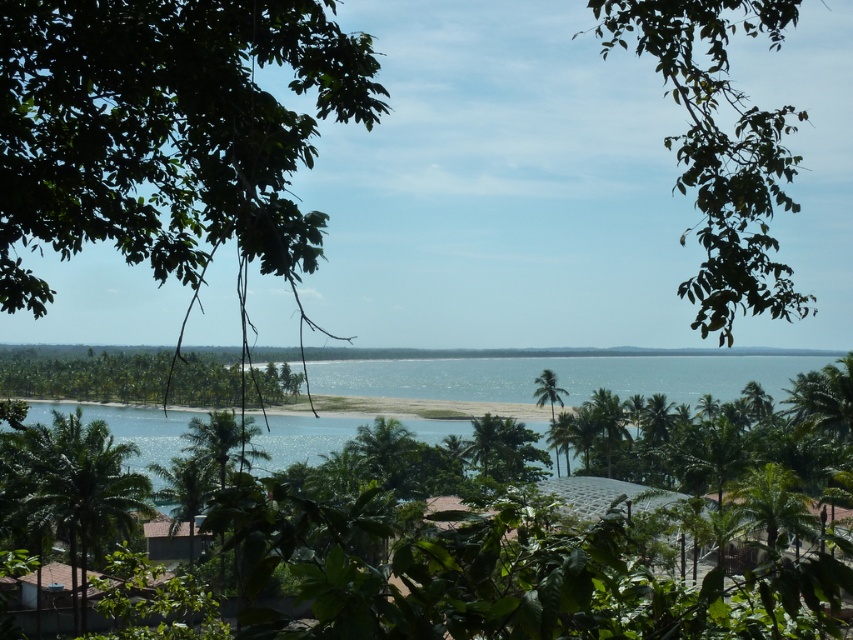
Question: Can you confirm if green leafy palm tree at lower left is positioned above green leafy tree at center?

Choices:
 (A) no
 (B) yes

Answer: (B)

Question: Is green leafy branch at upper right wider than green leafy palm tree at lower left?

Choices:
 (A) yes
 (B) no

Answer: (A)

Question: Which point appears closest to the camera in this image?

Choices:
 (A) (36, 548)
 (B) (791, 301)
 (C) (221, 394)

Answer: (B)

Question: Which is farther from the green leafy palm tree at lower left?

Choices:
 (A) green leafy branch at upper right
 (B) green leafy tree at center

Answer: (B)

Question: Which object is positioned farthest from the green leafy tree at center?

Choices:
 (A) green leafy branch at upper right
 (B) green leafy palm tree at lower left

Answer: (B)

Question: In this image, where is green leafy palm tree at lower left located relative to green leafy tree at center?

Choices:
 (A) right
 (B) left

Answer: (A)